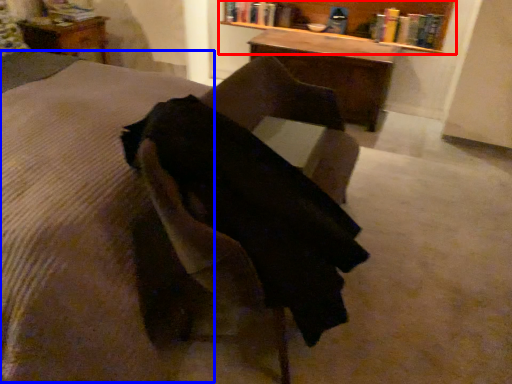
Question: Which object appears farthest to the camera in this image, bookcase (highlighted by a red box) or mattress (highlighted by a blue box)?

Choices:
 (A) bookcase
 (B) mattress

Answer: (A)